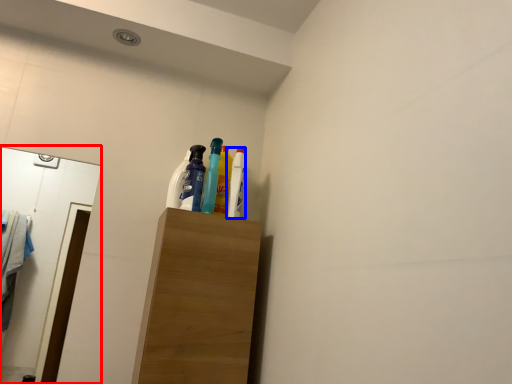
Question: Which object appears closest to the camera in this image, mirror (highlighted by a red box) or bottle (highlighted by a blue box)?

Choices:
 (A) mirror
 (B) bottle

Answer: (A)